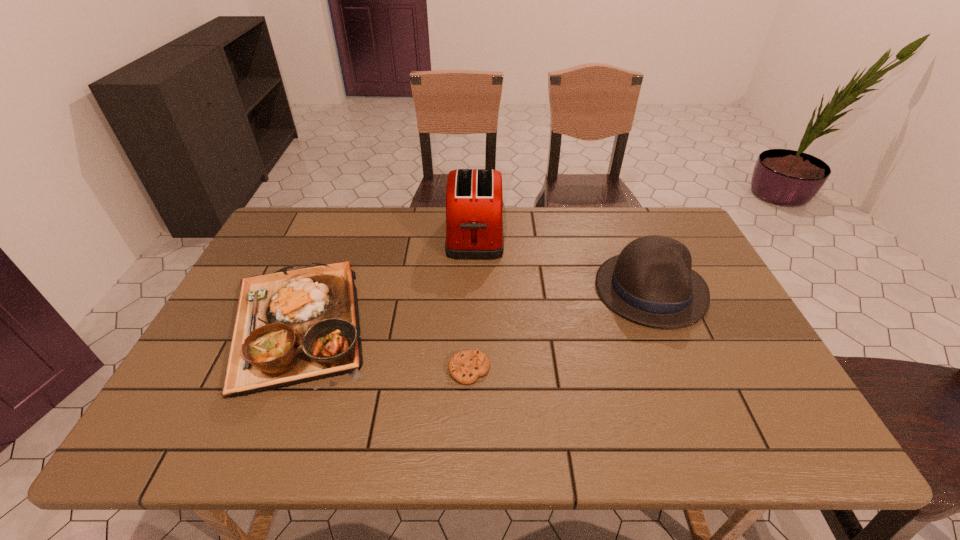
This screenshot has width=960, height=540. I want to click on vacant area that lies between the shortest object and the tallest object, so click(x=472, y=302).

Where is `empty space between the toaster and the cookie`? empty space between the toaster and the cookie is located at coordinates (472, 302).

You are a GUI agent. You are given a task and a screenshot of the screen. Output one action in this format:
    pyautogui.click(x=<x>, y=<y>)
    Task: Click on the free space between the second tallest object and the toaster
    This screenshot has width=960, height=540.
    Given the screenshot: What is the action you would take?
    pyautogui.click(x=563, y=262)

Identify the location of vacant area between the platter and the cookie. Image resolution: width=960 pixels, height=540 pixels. (383, 347).

I want to click on free spot between the platter and the rightmost object, so click(474, 307).

This screenshot has width=960, height=540. In order to click on free spot between the toaster and the leftmost object in this screenshot , I will do pos(386,280).

Find the location of a particular element. The image size is (960, 540). free space that is in between the shortest object and the toaster is located at coordinates (472, 302).

Locate an element on the screen. vacant space that is in between the cookie and the platter is located at coordinates (383, 347).

Locate an element on the screen. object that is the third closest to the toaster is located at coordinates (466, 366).

I want to click on object that stands as the closest to the third shortest object, so click(474, 198).